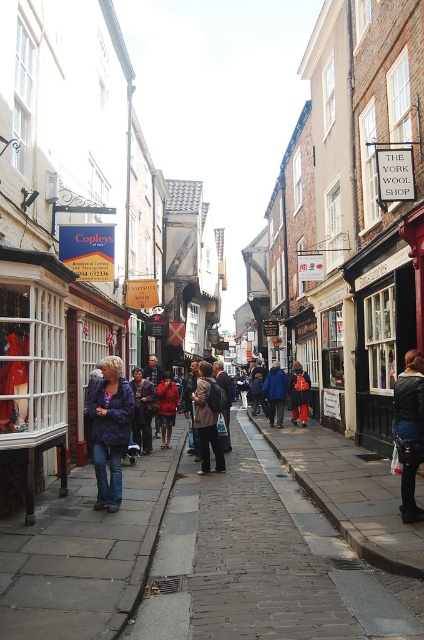
You are a customer shopping for jackets and see two jackets hanging in the window of Copleys of York. The jackets are the denim jacket at center and the dark blue jacket at center. Which jacket is wider?

The dark blue jacket at center is wider than the denim jacket at center since the denim jacket at center has a smaller width.

Consider the image. You are a customer in the store and see the denim jacket at center and the dark blue jacket at center. Which jacket is positioned higher in the display?

The denim jacket at center is positioned higher than the dark blue jacket at center.

You are standing in the middle of the street in York, England, and you see a denim jacket at left and a camera. Which object is closer to you?

The denim jacket at left is closer to you since it is only 9.98 meters away from the camera, which is farther away.